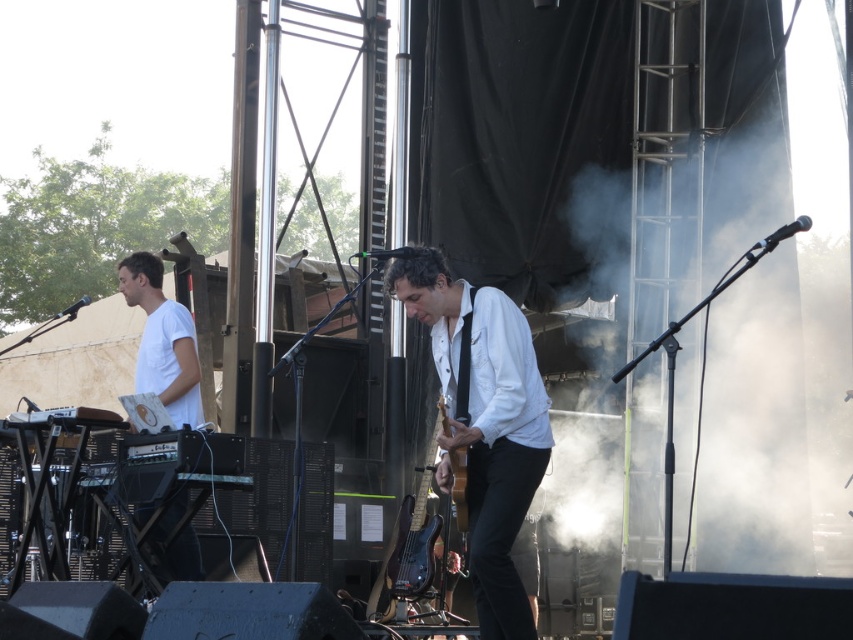
Question: In this image, where is white matte shirt at center located relative to wooden acoustic guitar at center?

Choices:
 (A) right
 (B) left

Answer: (A)

Question: Is white matte shirt at center in front of white matte shirt at left?

Choices:
 (A) no
 (B) yes

Answer: (B)

Question: Which of these objects is positioned closest to the white matte shirt at left?

Choices:
 (A) wooden acoustic guitar at center
 (B) white matte shirt at center

Answer: (A)

Question: Can you confirm if white matte shirt at left is thinner than wooden acoustic guitar at center?

Choices:
 (A) no
 (B) yes

Answer: (A)

Question: Which point is closer to the camera?

Choices:
 (A) (531, 435)
 (B) (189, 330)

Answer: (A)

Question: Which object is positioned closest to the white matte shirt at center?

Choices:
 (A) wooden acoustic guitar at center
 (B) white matte shirt at left

Answer: (A)